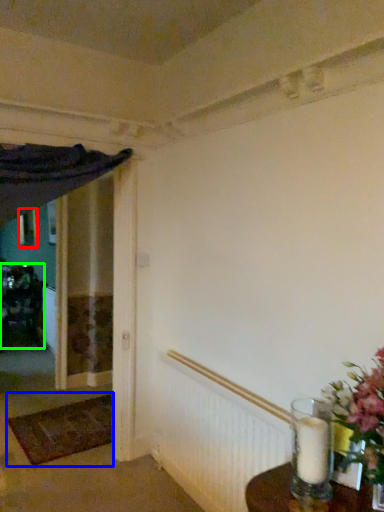
Question: Which object is the farthest from picture frame (highlighted by a red box)? Choose among these: doormat (highlighted by a blue box) or furniture (highlighted by a green box).

Choices:
 (A) doormat
 (B) furniture

Answer: (A)